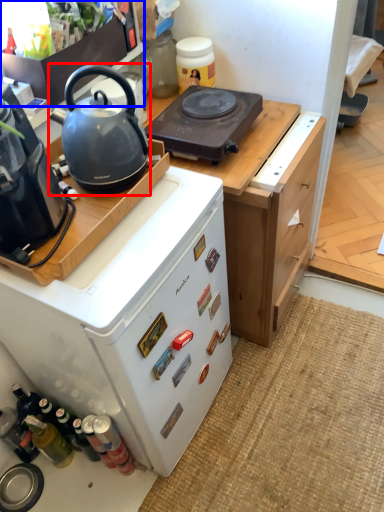
Question: Which of the following is the farthest to the observer, kettle (highlighted by a red box) or kitchen appliance (highlighted by a blue box)?

Choices:
 (A) kettle
 (B) kitchen appliance

Answer: (B)